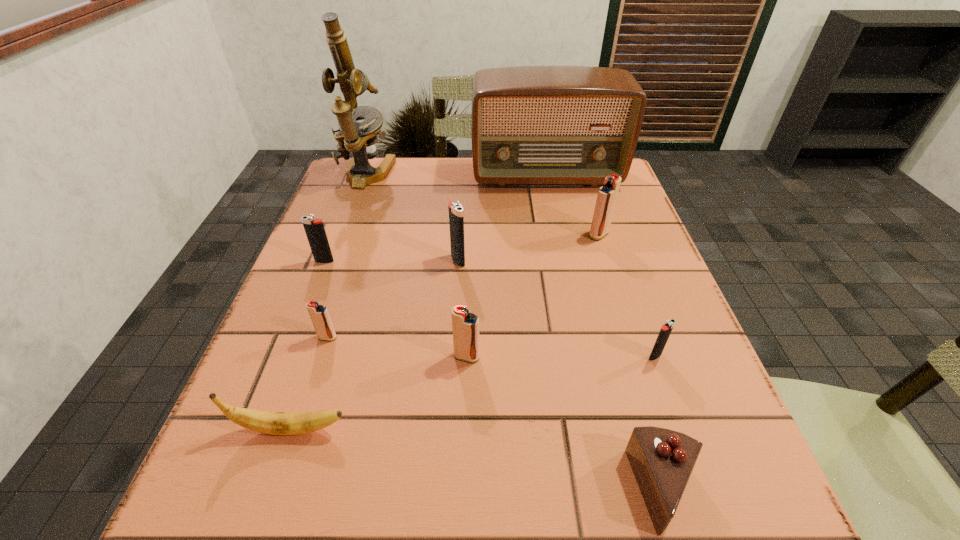
Find the location of a particular element. Image resolution: width=960 pixels, height=540 pixels. yellow banana is located at coordinates (276, 423).

Image resolution: width=960 pixels, height=540 pixels. Identify the location of the fifth nearest object. (319, 314).

Where is `the fourth farthest igniter`? This screenshot has height=540, width=960. the fourth farthest igniter is located at coordinates (319, 314).

The height and width of the screenshot is (540, 960). Find the location of `the smallest black igniter`. the smallest black igniter is located at coordinates (666, 329).

Image resolution: width=960 pixels, height=540 pixels. Identify the location of the nearest black igniter. (666, 329).

I want to click on the nearest object, so click(x=662, y=460).

Identify the location of vacant space located 0.350m on the front of the tallest object. The height and width of the screenshot is (540, 960). (324, 289).

You are a GUI agent. You are given a task and a screenshot of the screen. Output one action in this format:
    pyautogui.click(x=<x>, y=<y>)
    Task: Click on the vacant space located on the front-facing side of the ninth shortest object
    The height and width of the screenshot is (540, 960).
    Given the screenshot: What is the action you would take?
    pyautogui.click(x=560, y=242)

Locate an element on the screen. The image size is (960, 540). free space located 0.170m on the front of the rightmost red igniter is located at coordinates (618, 294).

In order to click on free location located 0.360m on the front of the biggest black igniter in this screenshot , I will do `click(449, 424)`.